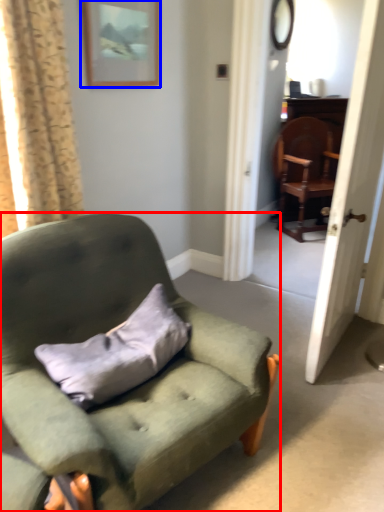
Question: Which point is closer to the camera, chair (highlighted by a red box) or picture frame (highlighted by a blue box)?

Choices:
 (A) chair
 (B) picture frame

Answer: (A)